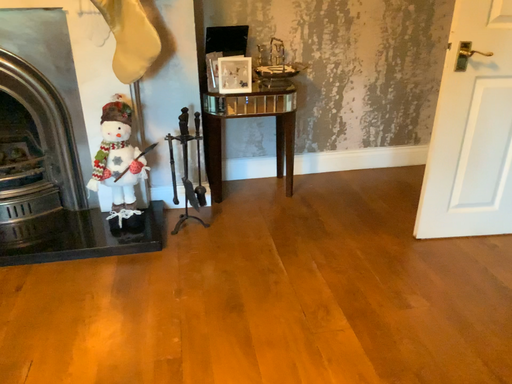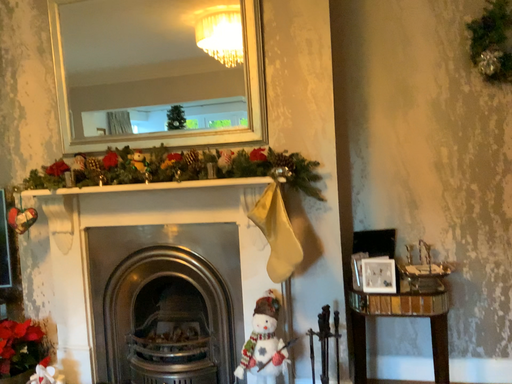
Question: How did the camera likely rotate when shooting the video?

Choices:
 (A) rotated downward
 (B) rotated upward

Answer: (B)